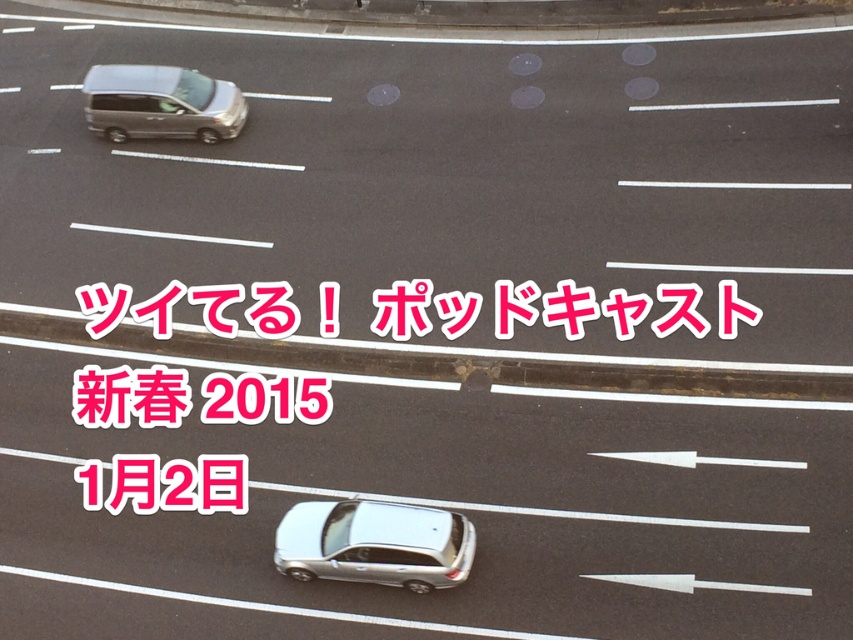
Question: Which object appears closest to the camera in this image?

Choices:
 (A) pink glossy text at upper center
 (B) pink paper text at center
 (C) satin silver van at upper left
 (D) satin silver sedan at lower center

Answer: (D)

Question: Considering the real-world distances, which object is closest to the pink glossy text at upper center?

Choices:
 (A) pink paper text at center
 (B) satin silver van at upper left

Answer: (A)

Question: Which of these objects is positioned closest to the satin silver van at upper left?

Choices:
 (A) satin silver sedan at lower center
 (B) pink paper text at center
 (C) pink glossy text at upper center

Answer: (C)

Question: Does pink paper text at center have a lesser width compared to pink glossy text at upper center?

Choices:
 (A) yes
 (B) no

Answer: (A)

Question: Can you confirm if satin silver sedan at lower center is positioned above satin silver van at upper left?

Choices:
 (A) no
 (B) yes

Answer: (A)

Question: Does pink glossy text at upper center appear over satin silver sedan at lower center?

Choices:
 (A) no
 (B) yes

Answer: (B)